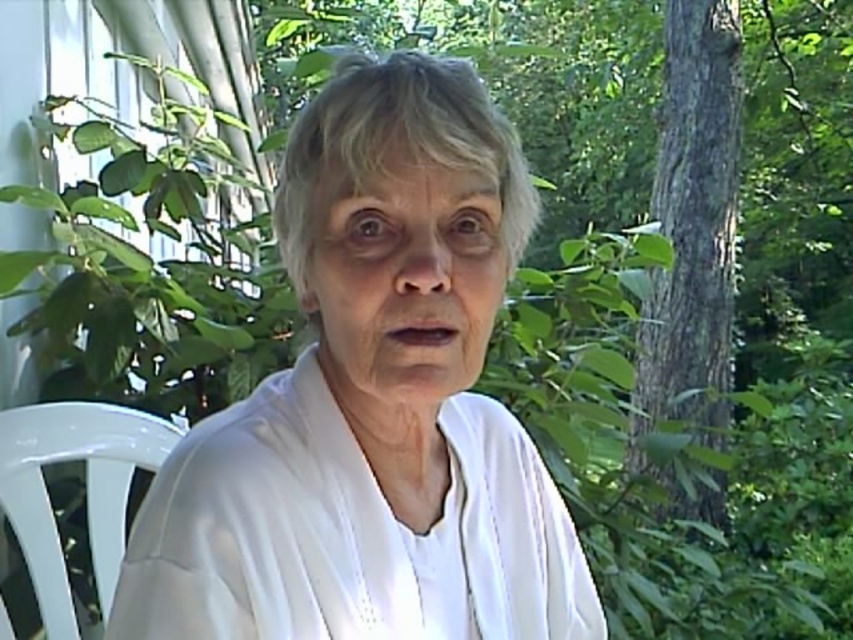
Which is behind, point (137, 598) or point (55, 426)?

Positioned behind is point (55, 426).

Describe the element at coordinates (347, 532) in the screenshot. The width and height of the screenshot is (853, 640). I see `white sheer robe at center` at that location.

You are a GUI agent. You are given a task and a screenshot of the screen. Output one action in this format:
    pyautogui.click(x=<x>, y=<y>)
    Task: Click on the white sheer robe at center
    
    Given the screenshot: What is the action you would take?
    pyautogui.click(x=347, y=532)

Can you confirm if white matte shirt at center is positioned below white plastic chair at left?

Actually, white matte shirt at center is above white plastic chair at left.

Can you confirm if white matte shirt at center is thinner than white plastic chair at left?

No, white matte shirt at center is not thinner than white plastic chair at left.

Find the location of a particular element. Image resolution: width=853 pixels, height=640 pixels. white matte shirt at center is located at coordinates (373, 403).

Is white matte shirt at center thinner than white sheer robe at center?

In fact, white matte shirt at center might be wider than white sheer robe at center.

Which is more to the left, white matte shirt at center or white sheer robe at center?

Positioned to the left is white matte shirt at center.

The height and width of the screenshot is (640, 853). What are the coordinates of `white matte shirt at center` in the screenshot? It's located at (373, 403).